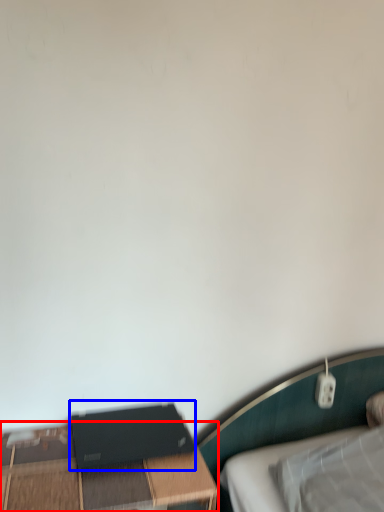
Question: Among these objects, which one is farthest to the camera, table (highlighted by a red box) or computer (highlighted by a blue box)?

Choices:
 (A) table
 (B) computer

Answer: (B)